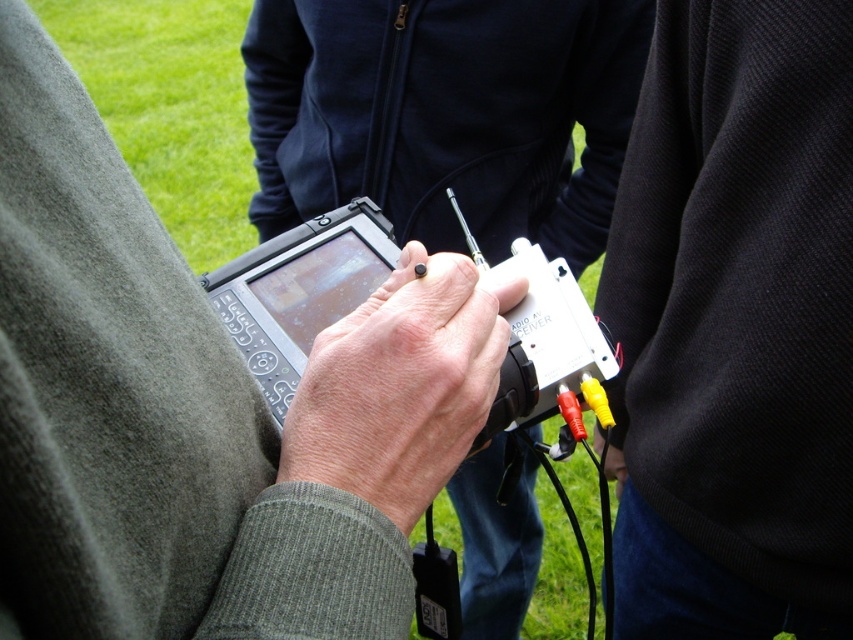
Question: Is white plastic device at center thinner than white plastic video camera at center?

Choices:
 (A) no
 (B) yes

Answer: (A)

Question: Which of the following is the farthest from the observer?

Choices:
 (A) white plastic device at center
 (B) matte black tablet at center

Answer: (A)

Question: Among these objects, which one is farthest from the camera?

Choices:
 (A) white plastic video camera at center
 (B) smooth skin hand at center
 (C) black textured sweater at center

Answer: (C)

Question: Does black textured sweater at center appear on the left side of white plastic device at center?

Choices:
 (A) yes
 (B) no

Answer: (B)

Question: Does matte black tablet at center have a lesser width compared to white plastic device at center?

Choices:
 (A) no
 (B) yes

Answer: (B)

Question: Which point is farther from the camera taking this photo?

Choices:
 (A) (312, 230)
 (B) (462, 317)
 (C) (379, 520)

Answer: (A)